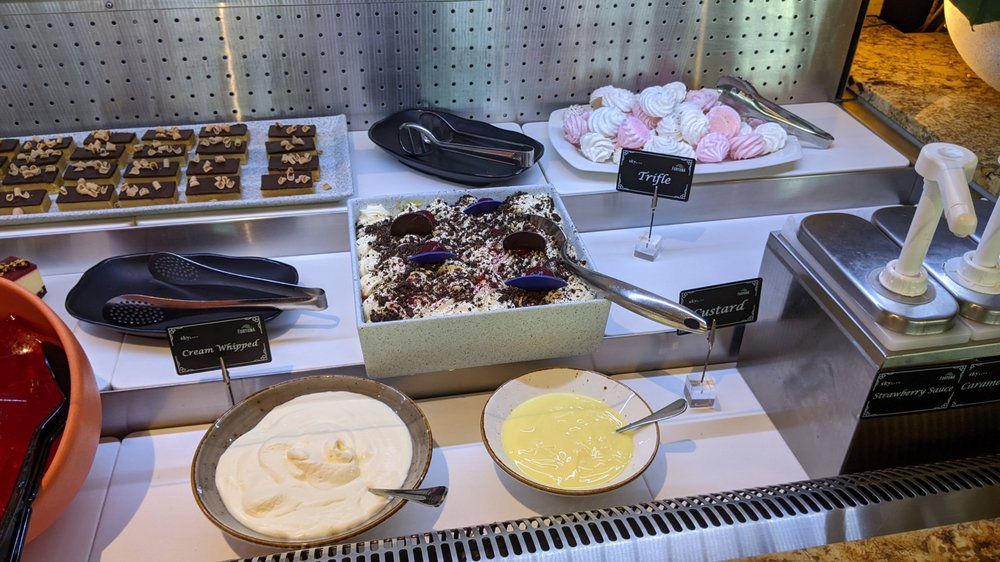
This screenshot has width=1000, height=562. Identify the location of spoons. pos(421,488), pos(675,398), pos(589,287).